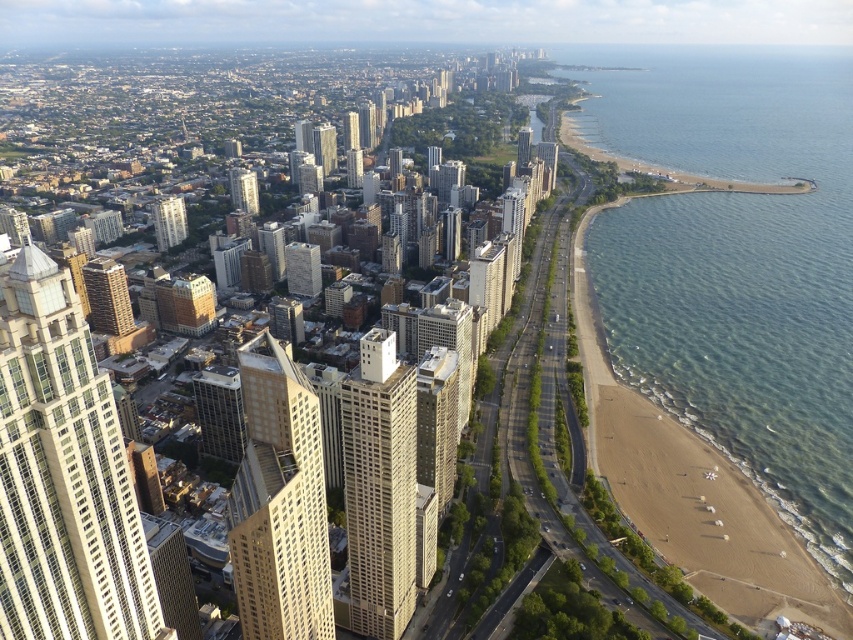
Question: Which point is closer to the camera taking this photo?

Choices:
 (A) (415, 401)
 (B) (21, 412)

Answer: (B)

Question: Which point is closer to the camera taking this photo?

Choices:
 (A) (389, 547)
 (B) (256, 192)

Answer: (A)

Question: Is clear blue water at beach right wider than matte glass skyscraper at center-left?

Choices:
 (A) no
 (B) yes

Answer: (B)

Question: Observing the image, what is the correct spatial positioning of beige concrete building at center in reference to white glass building at center-left?

Choices:
 (A) above
 (B) below

Answer: (B)

Question: Does beige glass skyscraper at left appear on the right side of beige concrete building at center?

Choices:
 (A) no
 (B) yes

Answer: (A)

Question: Among these objects, which one is nearest to the camera?

Choices:
 (A) beige glass skyscraper at center-left
 (B) beige glass skyscraper at left
 (C) beige concrete building at center
 (D) clear blue water at beach right

Answer: (B)